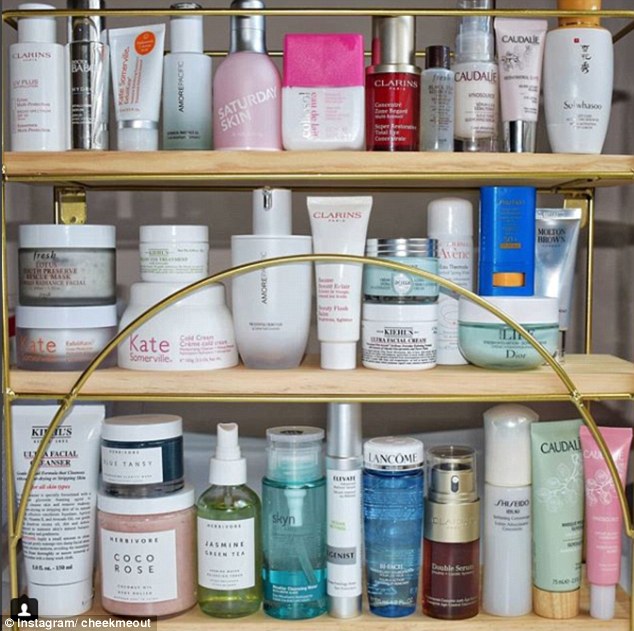
Where is `white product tube on bottom shelf, left side`? Image resolution: width=634 pixels, height=631 pixels. white product tube on bottom shelf, left side is located at coordinates (56, 593), (84, 447).